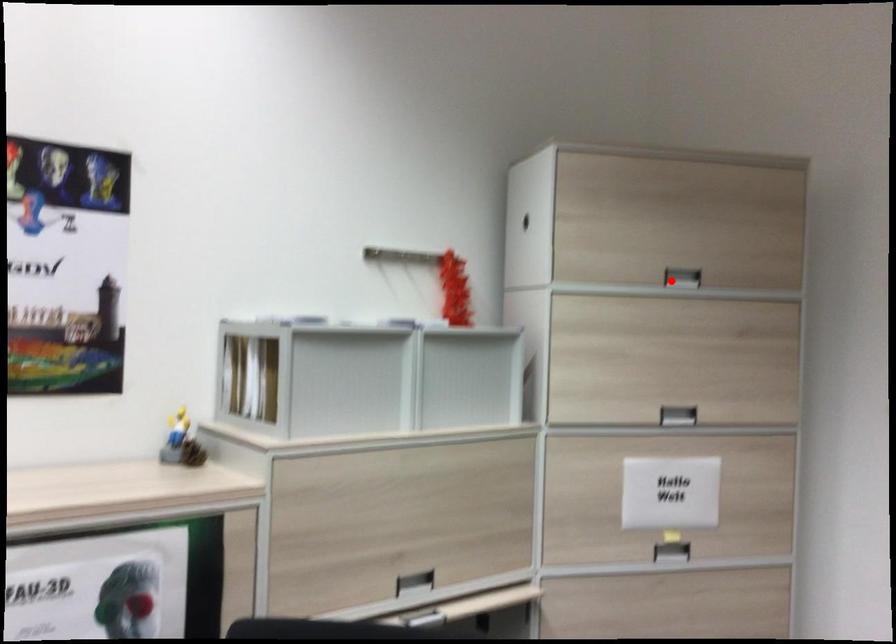
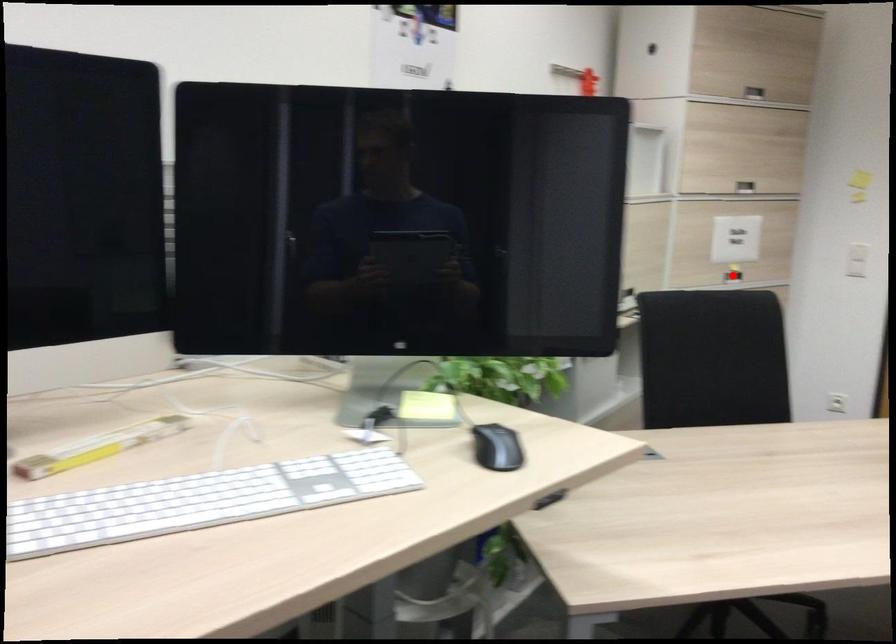
I am providing you with two images of the same scene from different viewpoints. A red point is marked on the first image and another point is marked on the second image. Does the point marked in image1 correspond to the same location as the one in image2?

No